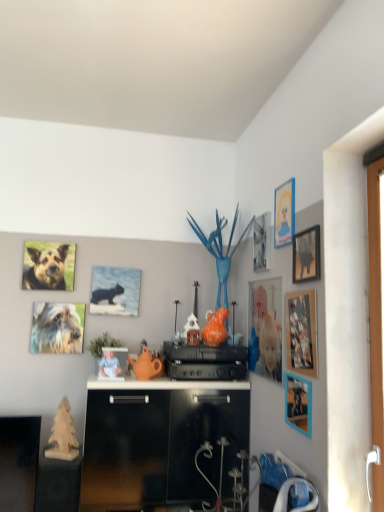
Question: Would you say matte blue cat at upper center, which is counted as the 8th picture frame, starting from the right, is to the left or to the right of matte plastic picture frame at center, which is the 7th picture frame from right to left, in the picture?

Choices:
 (A) right
 (B) left

Answer: (B)

Question: Which is correct: matte blue cat at upper center, which is counted as the 8th picture frame, starting from the right, is inside matte plastic picture frame at center, arranged as the second picture frame when viewed from the left, or outside of it?

Choices:
 (A) outside
 (B) inside

Answer: (A)

Question: Which of these objects is positioned farthest from the brown fur dog at upper left, the 2th dog from the bottom?

Choices:
 (A) white plastic handle at right
 (B) matte plastic picture frame at center-right, which is the 6th picture frame in right-to-left order
 (C) wooden picture frame at upper right, arranged as the 1th picture frame when viewed from the right
 (D) metallic silver picture frame at upper right, which is the fourth picture frame from left to right
 (E) matte plastic picture frame at upper right, acting as the fourth picture frame starting from the right

Answer: (A)

Question: Estimate the real-world distances between objects in this image. Which object is farther from the matte plastic picture frame at center-right, the third picture frame from the left?

Choices:
 (A) brown fur dog at upper left, the 2th dog from the bottom
 (B) white plastic handle at right
 (C) wooden picture frame at upper right, arranged as the 1th picture frame when viewed from the right
 (D) matte blue cat at upper center, which is counted as the first picture frame, starting from the left
 (E) metallic silver picture frame at upper right, which is counted as the fifth picture frame, starting from the right

Answer: (A)